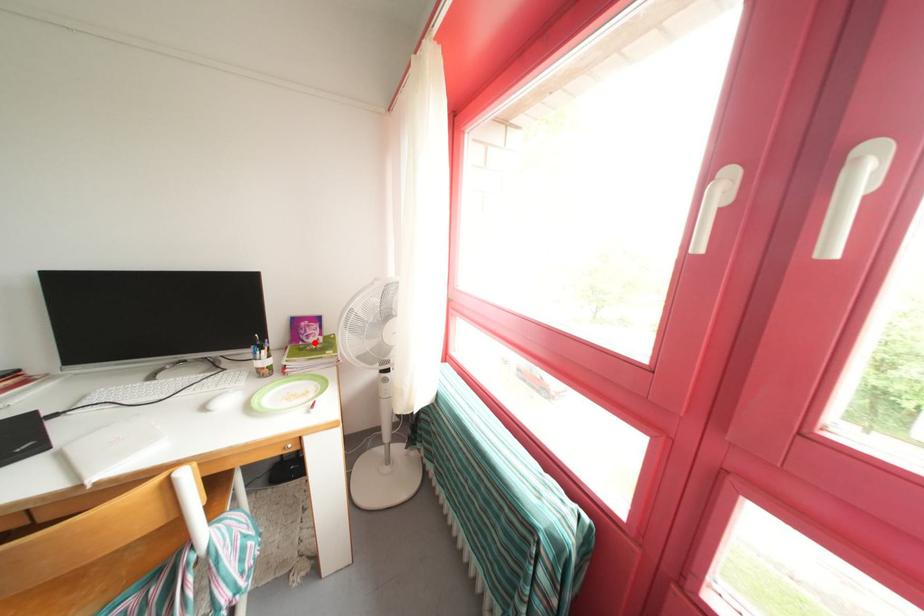
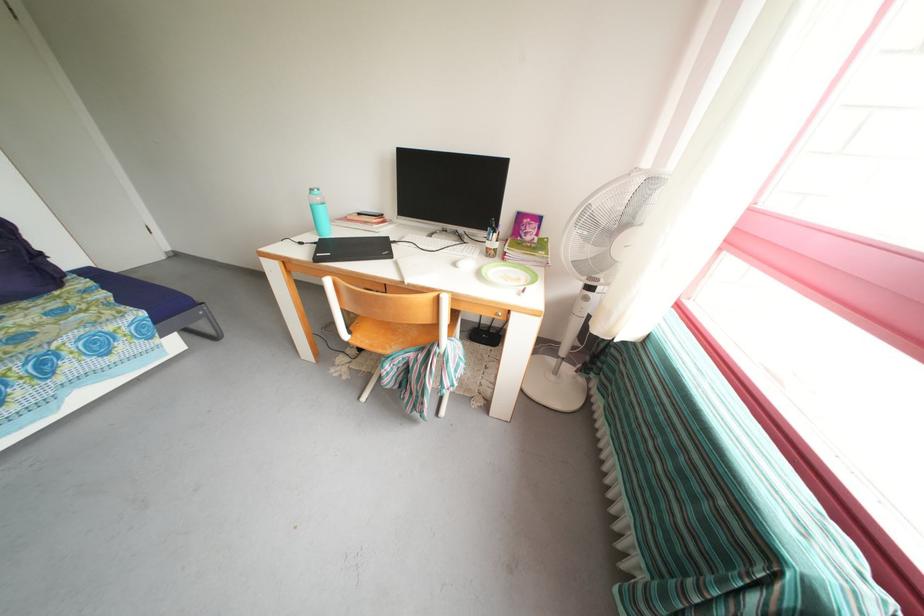
Question: I am providing you with two images of the same scene from different viewpoints. Image1 has a red point marked. In image2, the corresponding 3D location appears at what relative position? Reply with the corresponding letter.

Choices:
 (A) Closer
 (B) Farther

Answer: (A)